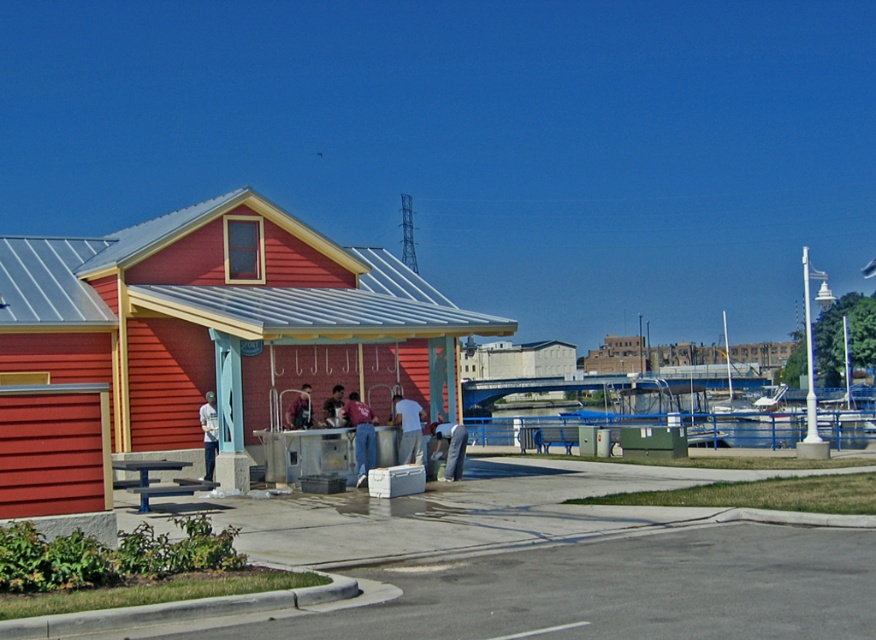
You are standing at the entrance of the red building with yellow trim and need to find the matte red shirt at center. According to the coordinates provided, in which direction should you look to locate it?

The matte red shirt at center is located at coordinates point (x=359, y=433), which means it is positioned to the right and slightly above the center of the scene. You should look towards the right side of the building and a bit upwards from the center point to find it.

You are standing at the entrance of the red building with yellow trim and need to locate two people wearing gray fabric pants at center and denim jacket at center. Which one is positioned to the right side from your perspective?

The gray fabric pants at center is to the right of denim jacket at center, so the person wearing gray fabric pants at center is positioned to the right side from your perspective.

You are standing at the entrance of the red building with a yellow trim and a metal roof. You see a gray fabric pants at center and a denim jacket at center. Can you walk directly between them without stepping on either?

The distance between the gray fabric pants at center and the denim jacket at center is 7.85 feet, which is more than enough space for a person to walk between them without stepping on either.